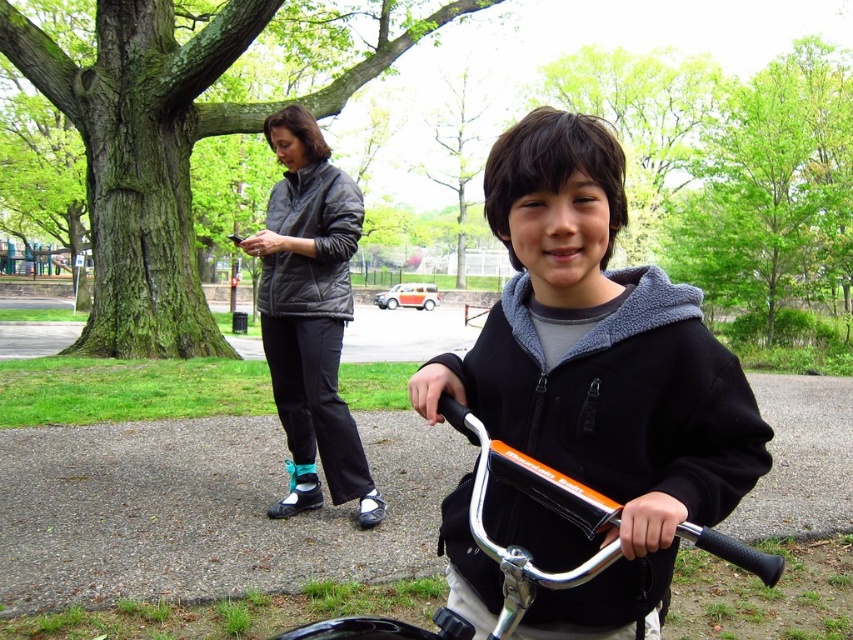
Is point (735, 401) positioned in front of point (297, 282)?

That is True.

Is point (555, 448) positioned after point (334, 209)?

That is False.

This screenshot has width=853, height=640. Find the location of `black fleece jacket at center`. black fleece jacket at center is located at coordinates (595, 381).

Which of these two, matte black jacket at upper left or orange metallic bicycle handlebars at center, stands taller?

With more height is matte black jacket at upper left.

Which is below, matte black jacket at upper left or orange metallic bicycle handlebars at center?

orange metallic bicycle handlebars at center

Find the location of `matte black jacket at upper left`. matte black jacket at upper left is located at coordinates (310, 314).

Which is more to the left, black fleece jacket at center or matte black jacket at upper left?

matte black jacket at upper left

Between black fleece jacket at center and matte black jacket at upper left, which one has more height?

matte black jacket at upper left

Find the location of a particular element. The height and width of the screenshot is (640, 853). black fleece jacket at center is located at coordinates (595, 381).